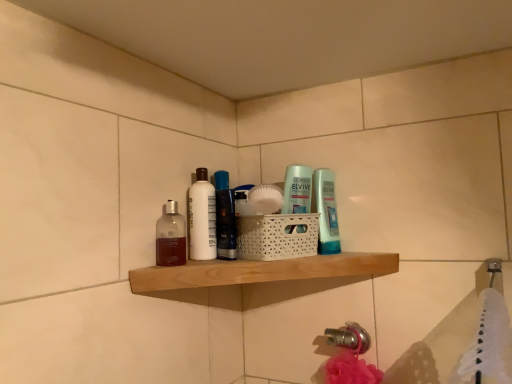
Question: Is white matte bottle at center, arranged as the first toiletry when viewed from the left, thinner than translucent plastic bottle at center, marked as the 2th toiletry in a left-to-right arrangement?

Choices:
 (A) yes
 (B) no

Answer: (B)

Question: Is white matte bottle at center, arranged as the first toiletry when viewed from the left, directly adjacent to translucent plastic bottle at center, marked as the 2th toiletry in a left-to-right arrangement?

Choices:
 (A) yes
 (B) no

Answer: (B)

Question: Can you confirm if white matte bottle at center, which is the second toiletry from right to left, is positioned to the left of translucent plastic bottle at center, placed as the 1th toiletry when sorted from right to left?

Choices:
 (A) no
 (B) yes

Answer: (B)

Question: Is white matte bottle at center, arranged as the first toiletry when viewed from the left, bigger than translucent plastic bottle at center, placed as the 1th toiletry when sorted from right to left?

Choices:
 (A) yes
 (B) no

Answer: (A)

Question: Is white matte bottle at center, which is the second toiletry from right to left, outside of translucent plastic bottle at center, marked as the 2th toiletry in a left-to-right arrangement?

Choices:
 (A) yes
 (B) no

Answer: (A)

Question: From a real-world perspective, is translucent plastic bottle at center, marked as the 2th toiletry in a left-to-right arrangement, physically located above or below natural wood shelf at center?

Choices:
 (A) above
 (B) below

Answer: (A)

Question: Considering the positions of translucent plastic bottle at center, marked as the 2th toiletry in a left-to-right arrangement, and natural wood shelf at center in the image, is translucent plastic bottle at center, marked as the 2th toiletry in a left-to-right arrangement, bigger or smaller than natural wood shelf at center?

Choices:
 (A) small
 (B) big

Answer: (A)

Question: From the image's perspective, is translucent plastic bottle at center, placed as the 1th toiletry when sorted from right to left, above or below natural wood shelf at center?

Choices:
 (A) above
 (B) below

Answer: (A)

Question: Choose the correct answer: Is translucent plastic bottle at center, placed as the 1th toiletry when sorted from right to left, inside natural wood shelf at center or outside it?

Choices:
 (A) inside
 (B) outside

Answer: (B)

Question: Considering their positions, is white matte bottle at center, which is the second toiletry from right to left, located in front of or behind translucent plastic bottle at center, placed as the 1th toiletry when sorted from right to left?

Choices:
 (A) behind
 (B) front

Answer: (A)

Question: In terms of height, does white matte bottle at center, which is the second toiletry from right to left, look taller or shorter compared to translucent plastic bottle at center, placed as the 1th toiletry when sorted from right to left?

Choices:
 (A) tall
 (B) short

Answer: (A)

Question: In terms of width, does white matte bottle at center, which is the second toiletry from right to left, look wider or thinner when compared to translucent plastic bottle at center, placed as the 1th toiletry when sorted from right to left?

Choices:
 (A) thin
 (B) wide

Answer: (B)

Question: From a real-world perspective, relative to translucent plastic bottle at center, marked as the 2th toiletry in a left-to-right arrangement, is white matte bottle at center, arranged as the first toiletry when viewed from the left, vertically above or below?

Choices:
 (A) above
 (B) below

Answer: (A)

Question: Does point (163, 243) appear closer or farther from the camera than point (329, 180)?

Choices:
 (A) farther
 (B) closer

Answer: (B)

Question: Would you say translucent glass mouthwash at shelf center, the first mouthwash viewed from the front, is to the left or to the right of translucent plastic bottle at center, marked as the 2th toiletry in a left-to-right arrangement, in the picture?

Choices:
 (A) left
 (B) right

Answer: (A)